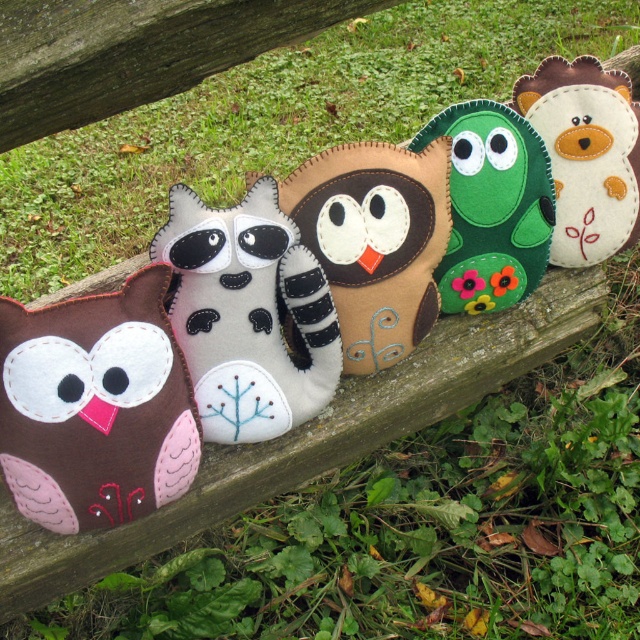
Which is more to the right, felt/soft toy at center or brown felt/soft toy at center?

brown felt/soft toy at center

Between point (296, 317) and point (365, 310), which one is positioned behind?

Point (365, 310)

At what (x,y) coordinates should I click in order to perform the action: click on felt/soft toy at center. Please return your answer as a coordinate pair (x, y). Image resolution: width=640 pixels, height=640 pixels. Looking at the image, I should click on (248, 314).

Can you confirm if green felt/soft toy at center is positioned to the right of felt bear at upper right?

In fact, green felt/soft toy at center is to the left of felt bear at upper right.

Does green felt/soft toy at center appear on the left side of felt bear at upper right?

Indeed, green felt/soft toy at center is positioned on the left side of felt bear at upper right.

Who is more distant from viewer, (x=538, y=221) or (x=586, y=221)?

Positioned behind is point (x=586, y=221).

At what (x,y) coordinates should I click in order to perform the action: click on green felt/soft toy at center. Please return your answer as a coordinate pair (x, y). This screenshot has width=640, height=640. Looking at the image, I should click on (492, 205).

Does felt/soft toy at center appear over felt bear at upper right?

No, felt/soft toy at center is not above felt bear at upper right.

Which of these two, felt/soft toy at center or felt bear at upper right, stands shorter?

felt bear at upper right

Which is behind, point (250, 372) or point (632, 141)?

The point (632, 141) is more distant.

The height and width of the screenshot is (640, 640). In order to click on felt/soft toy at center in this screenshot , I will do `click(248, 314)`.